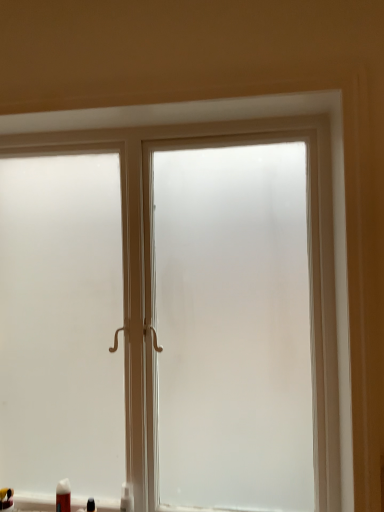
Question: From a real-world perspective, is matte black toothpaste tube at lower left, which is the fourth toiletry from right to left, positioned above or below frosted glass window at center?

Choices:
 (A) below
 (B) above

Answer: (A)

Question: Do you think matte black toothpaste tube at lower left, the first toiletry in the left-to-right sequence, is within frosted glass window at center, or outside of it?

Choices:
 (A) outside
 (B) inside

Answer: (B)

Question: Considering the real-world distances, which object is closest to the matte black toothpaste tube at lower left, the first toiletry in the left-to-right sequence?

Choices:
 (A) white plastic bottle at lower left, acting as the 1th toiletry starting from the right
 (B) white matte tube at lower left, acting as the 2th toiletry starting from the left
 (C) matte black bottle at lower left, which ranks as the 2th toiletry in right-to-left order
 (D) frosted glass window at center

Answer: (B)

Question: Which of these objects is positioned farthest from the matte black bottle at lower left, which ranks as the 2th toiletry in right-to-left order?

Choices:
 (A) frosted glass window at center
 (B) white plastic bottle at lower left, acting as the 1th toiletry starting from the right
 (C) matte black toothpaste tube at lower left, which is the fourth toiletry from right to left
 (D) white matte tube at lower left, positioned as the 3th toiletry in right-to-left order

Answer: (A)